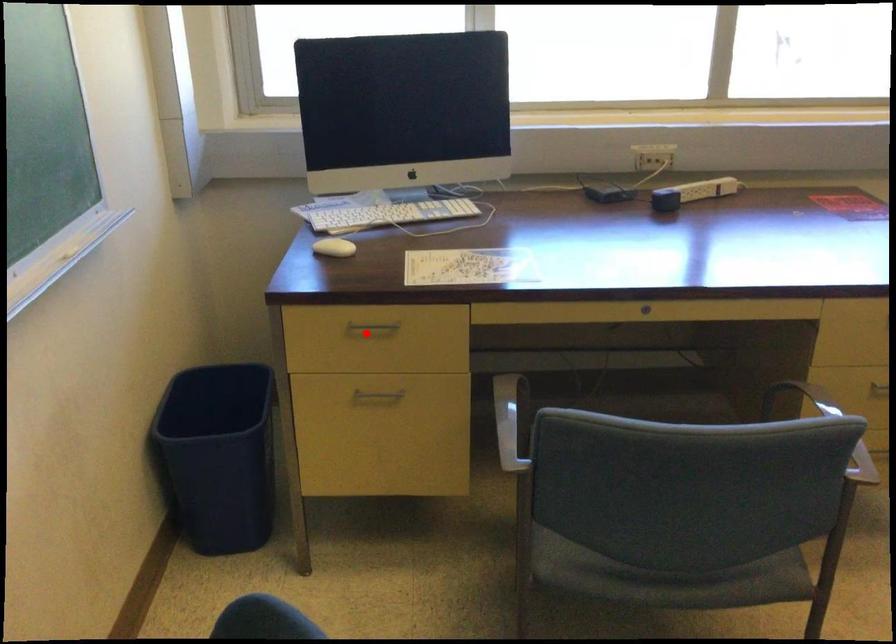
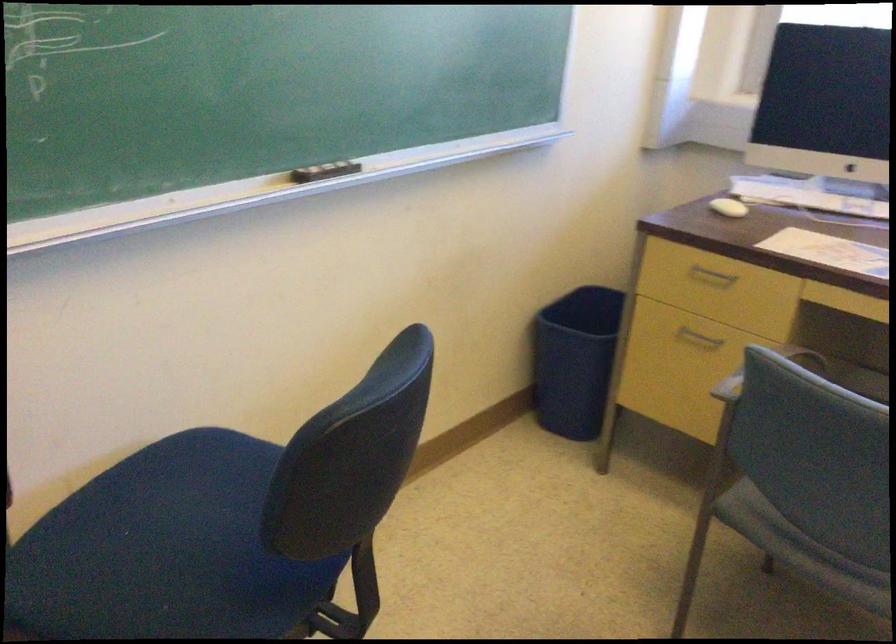
Where in the second image is the point corresponding to the highlighted location from the first image?

(711, 277)